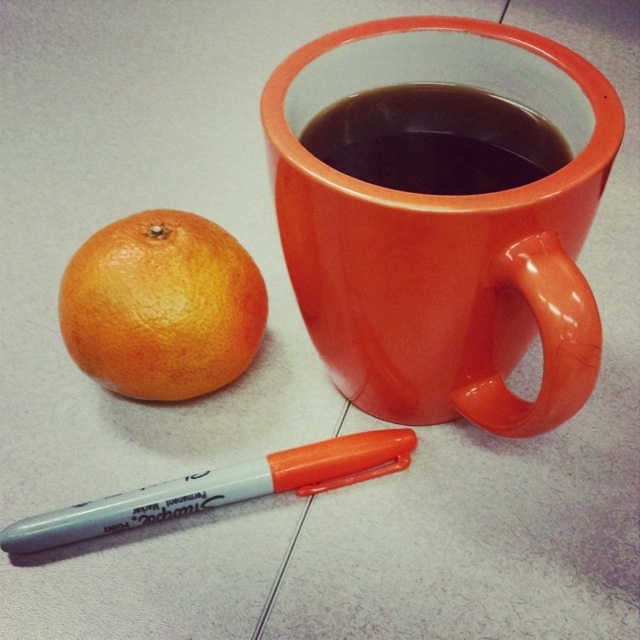
Question: Is orange matte/orange peel at left thinner than gray plastic marker at lower left?

Choices:
 (A) no
 (B) yes

Answer: (B)

Question: Among these points, which one is nearest to the camera?

Choices:
 (A) (401, 129)
 (B) (273, 179)
 (C) (339, 465)
 (D) (125, 278)

Answer: (B)

Question: From the image, what is the correct spatial relationship of orange matte/orange peel at left in relation to gray plastic marker at lower left?

Choices:
 (A) below
 (B) above

Answer: (B)

Question: Does orange matte/orange peel at left appear under black glossy mug at upper center?

Choices:
 (A) no
 (B) yes

Answer: (B)

Question: Which object appears closest to the camera in this image?

Choices:
 (A) gray plastic marker at lower left
 (B) orange matte/orange peel at left

Answer: (A)

Question: Which point is farther from the camera taking this photo?

Choices:
 (A) (348, 444)
 (B) (612, 161)

Answer: (A)